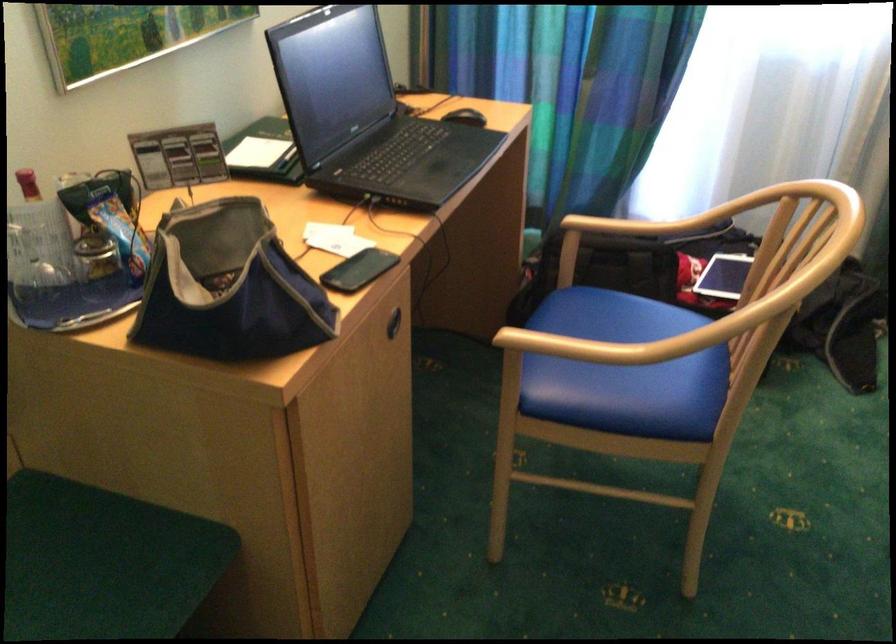
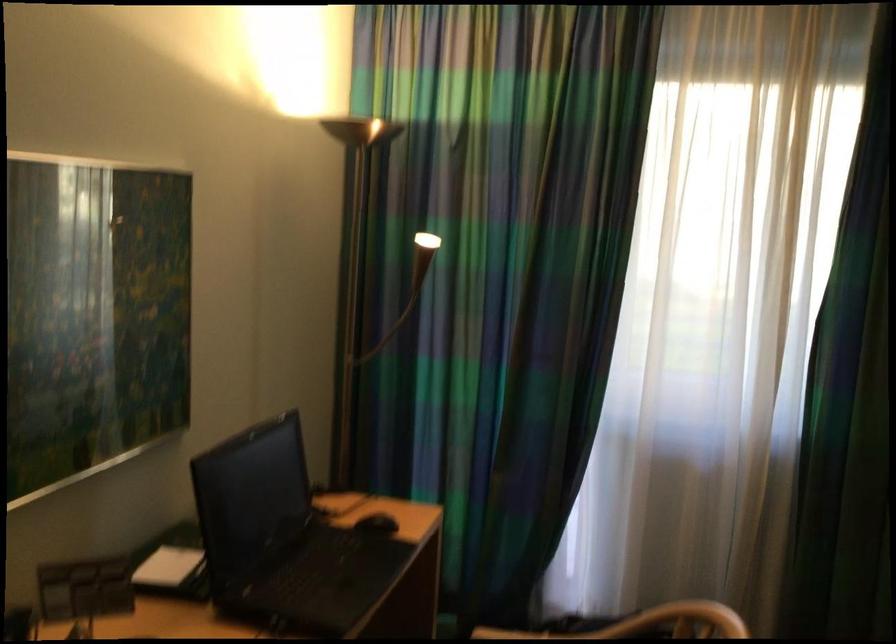
Question: The first image is from the beginning of the video and the second image is from the end. How did the camera likely rotate when shooting the video?

Choices:
 (A) Left
 (B) Right
 (C) Up
 (D) Down

Answer: (C)